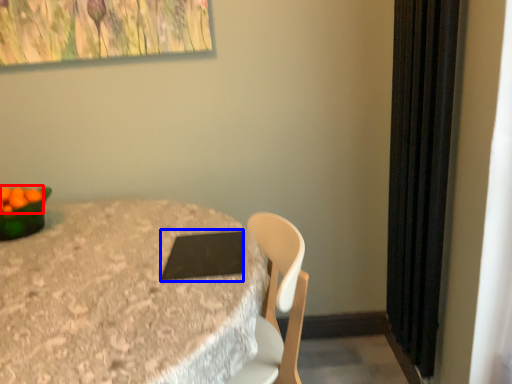
Question: Which object is further to the camera taking this photo, fruit (highlighted by a red box) or pad (highlighted by a blue box)?

Choices:
 (A) fruit
 (B) pad

Answer: (A)